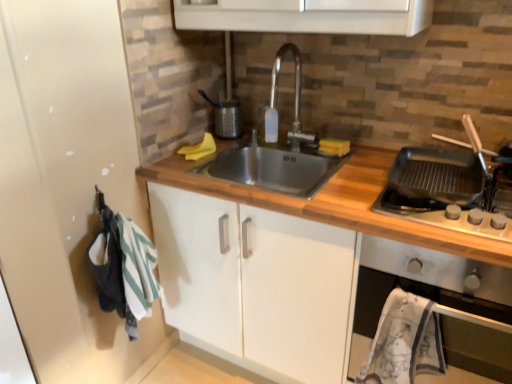
Question: Is black matte griddle at right facing towards metallic silver oven at right?

Choices:
 (A) yes
 (B) no

Answer: (B)

Question: Considering the relative positions of black matte griddle at right and metallic silver oven at right in the image provided, is black matte griddle at right to the left of metallic silver oven at right from the viewer's perspective?

Choices:
 (A) yes
 (B) no

Answer: (A)

Question: Does black matte griddle at right have a smaller size compared to metallic silver oven at right?

Choices:
 (A) yes
 (B) no

Answer: (A)

Question: From the image's perspective, would you say black matte griddle at right is shown under metallic silver oven at right?

Choices:
 (A) yes
 (B) no

Answer: (B)

Question: Does black matte griddle at right contain metallic silver oven at right?

Choices:
 (A) no
 (B) yes

Answer: (A)

Question: Is black matte griddle at right next to metallic silver oven at right and touching it?

Choices:
 (A) yes
 (B) no

Answer: (B)

Question: From the image's perspective, does satin nickel faucet at center appear lower than wooden at center?

Choices:
 (A) yes
 (B) no

Answer: (B)

Question: From a real-world perspective, is satin nickel faucet at center positioned over wooden at center based on gravity?

Choices:
 (A) yes
 (B) no

Answer: (A)

Question: From the image's perspective, is satin nickel faucet at center on top of wooden at center?

Choices:
 (A) yes
 (B) no

Answer: (A)

Question: Is satin nickel faucet at center bigger than wooden at center?

Choices:
 (A) yes
 (B) no

Answer: (B)

Question: Is satin nickel faucet at center taller than wooden at center?

Choices:
 (A) yes
 (B) no

Answer: (B)

Question: Considering the relative sizes of satin nickel faucet at center and wooden at center in the image provided, is satin nickel faucet at center thinner than wooden at center?

Choices:
 (A) yes
 (B) no

Answer: (A)

Question: Does wooden at center lie behind metallic silver oven at right?

Choices:
 (A) yes
 (B) no

Answer: (B)